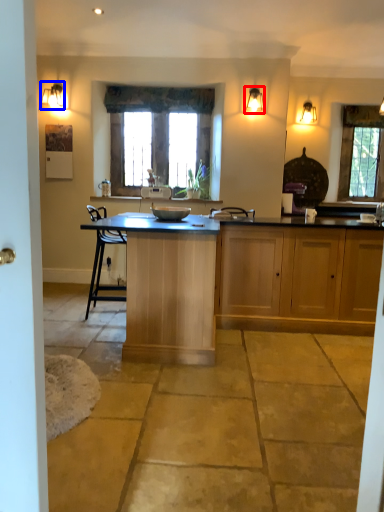
Question: Among these objects, which one is nearest to the camera, light fixture (highlighted by a red box) or light fixture (highlighted by a blue box)?

Choices:
 (A) light fixture
 (B) light fixture

Answer: (A)